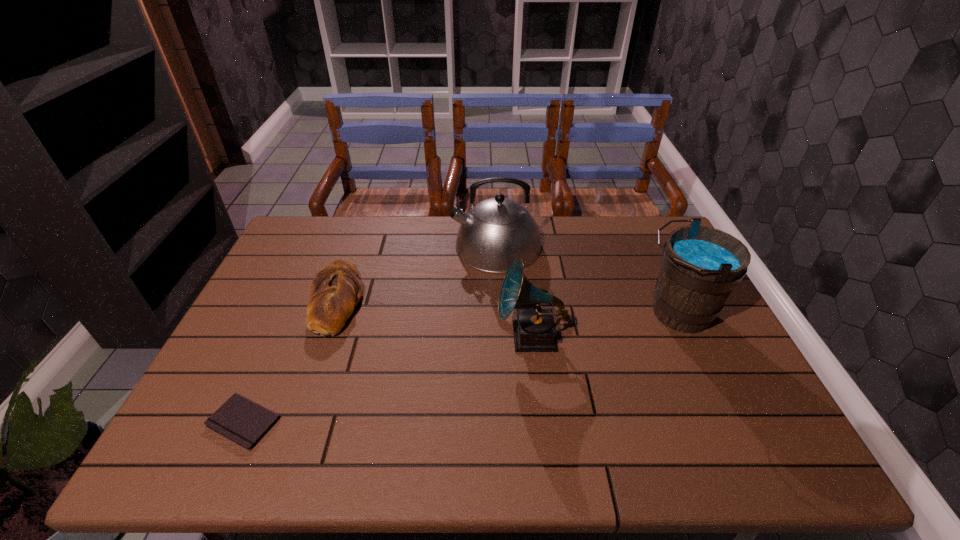
At what (x,y) coordinates should I click in order to perform the action: click on vacant space located with a handle on the side of the wine bucket. Please return your answer as a coordinate pair (x, y). The width and height of the screenshot is (960, 540). Looking at the image, I should click on (548, 313).

Identify the location of vacant space located 0.340m with a handle on the side of the wine bucket. This screenshot has width=960, height=540. (516, 313).

Where is `vacant space located 0.340m from the horn of the phonograph_record`? vacant space located 0.340m from the horn of the phonograph_record is located at coordinates (371, 336).

Where is `free space located from the horn of the phonograph_record`? The height and width of the screenshot is (540, 960). free space located from the horn of the phonograph_record is located at coordinates (434, 336).

Where is `free space located 0.060m from the horn of the phonograph_record`? The height and width of the screenshot is (540, 960). free space located 0.060m from the horn of the phonograph_record is located at coordinates (475, 336).

The height and width of the screenshot is (540, 960). I want to click on free spot located on the front of the fourth tallest object, so click(307, 380).

Where is `vacant region located 0.050m on the back of the shortest object`? The image size is (960, 540). vacant region located 0.050m on the back of the shortest object is located at coordinates (264, 378).

The image size is (960, 540). I want to click on object present at the far edge, so point(495,232).

Locate an element on the screen. object located in the near edge section of the desktop is located at coordinates (244, 422).

Find the location of a particular element. object that is at the left edge is located at coordinates (244, 422).